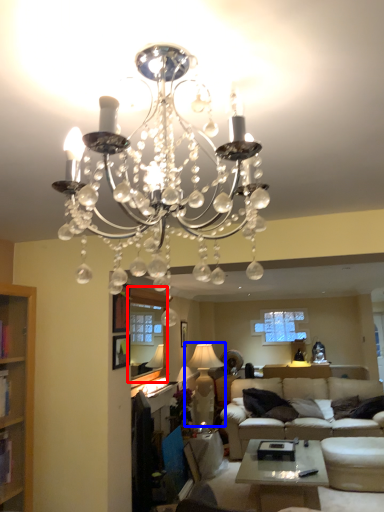
Question: Which of the following is the farthest to the observer, window screen (highlighted by a red box) or lamp (highlighted by a blue box)?

Choices:
 (A) window screen
 (B) lamp

Answer: (B)